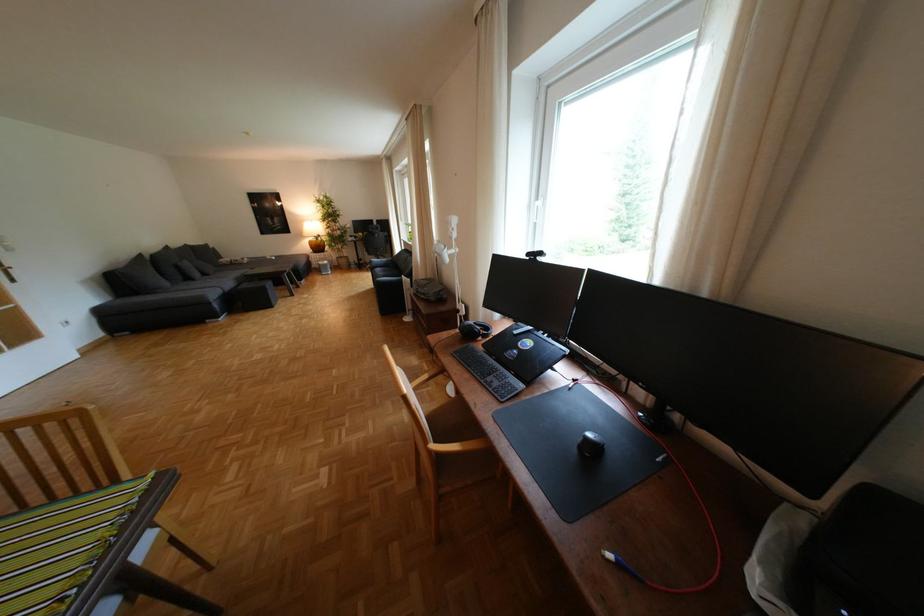
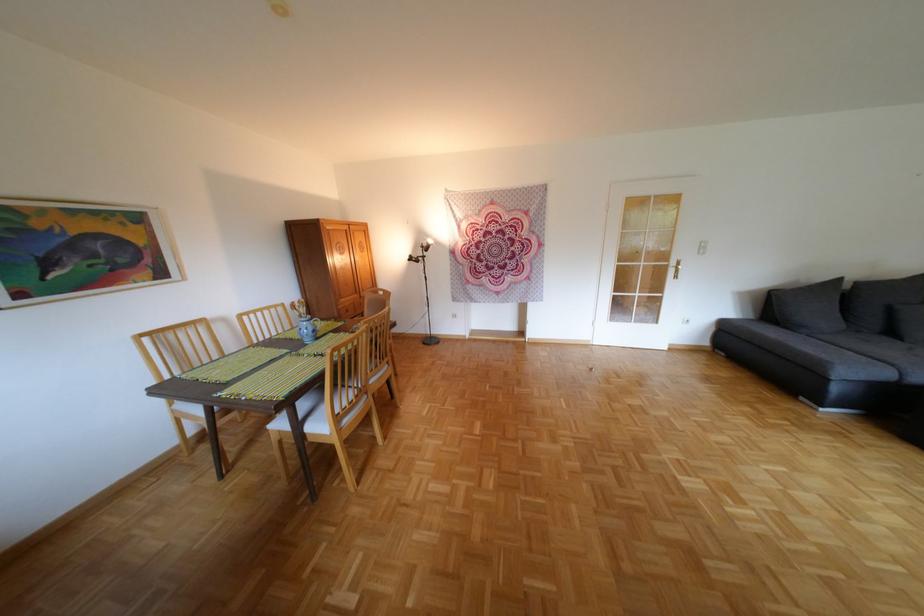
Find the pixel in the second image that matches [131,282] in the first image.

(787, 304)